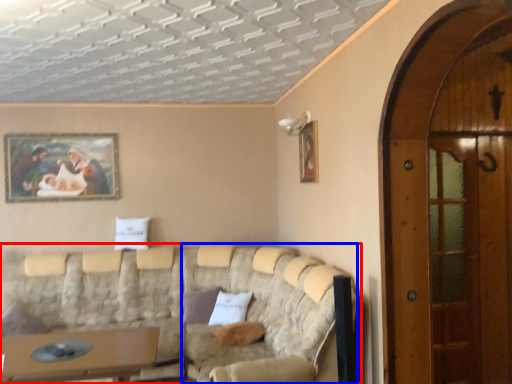
Question: Which of the following is the closest to the observer, studio couch (highlighted by a red box) or couch (highlighted by a blue box)?

Choices:
 (A) studio couch
 (B) couch

Answer: (A)